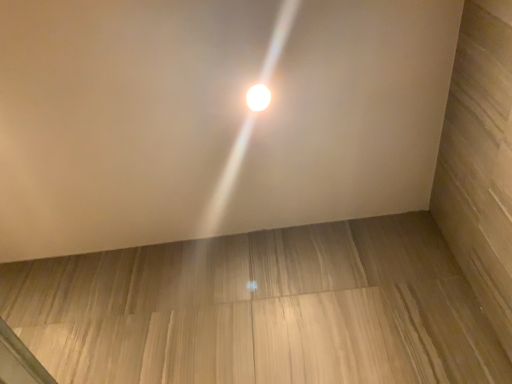
Find the location of a particular element. The height and width of the screenshot is (384, 512). free region on the left part of white glossy light bulb at upper center is located at coordinates (186, 104).